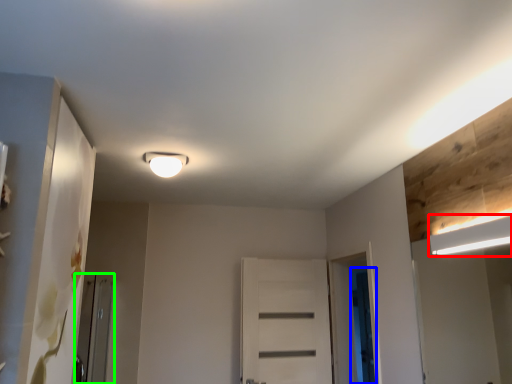
Question: Estimate the real-world distances between objects in this image. Which object is farther from lamp (highlighted by a red box), screen door (highlighted by a blue box) or screen door (highlighted by a green box)?

Choices:
 (A) screen door
 (B) screen door

Answer: (B)